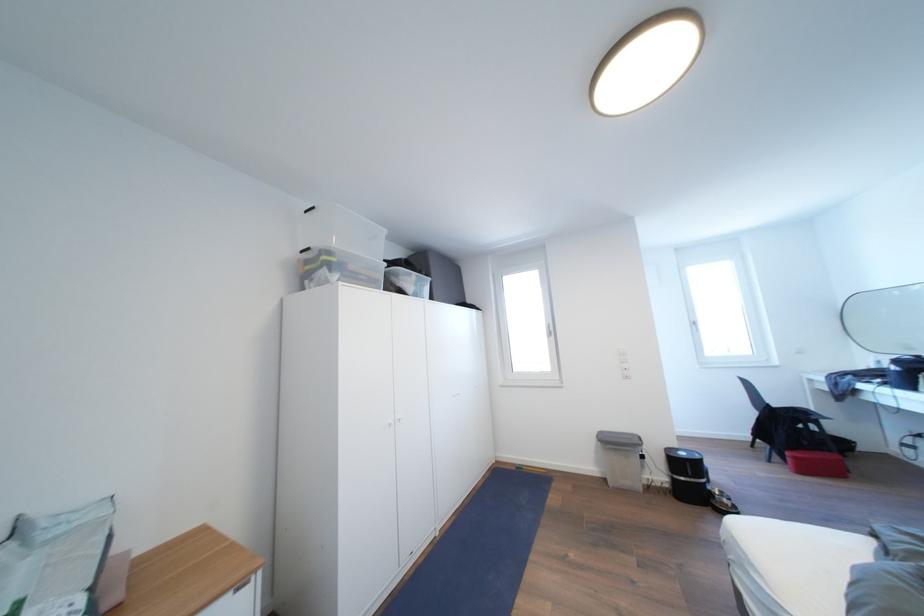
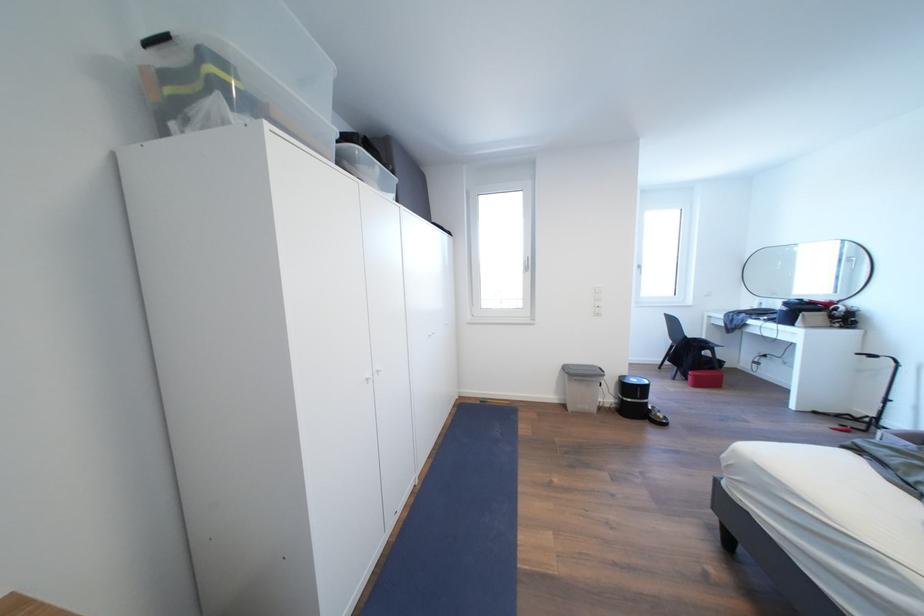
What movement of the cameraman would produce the second image?

The cameraman walked toward left, forward.